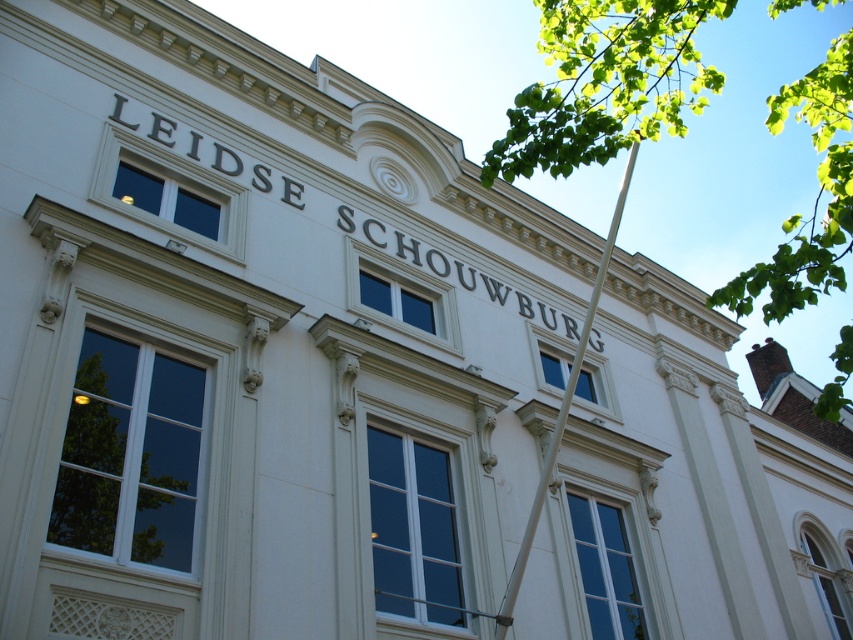
You are standing in front of the Leiden Theatre and notice two points marked on the building facade. The first point is at coordinates point [752,273] and the second is at point [61,529]. Which point is closer to your eyes?

Point [752,273] is further to the viewer than point [61,529], so the point closer to your eyes is point [61,529].

You are a photographer standing in front of the Leiden Theatre. You want to capture a photo that includes both the green leafy tree at upper right and the white metallic pole at upper right. However, you notice that one of them is blocking the other. Which object is blocking the other?

The green leafy tree at upper right is in front of the white metallic pole at upper right, so the tree is blocking the pole.

You are standing in front of the Leiden Theatre and want to take a photo of the building without any obstructions. The green leafy tree at lower left is in the way. Where should you move to avoid it?

Move to the right side of the building since the green leafy tree at lower left is located at the lower left corner, which is at point (131, 456) in 2D coordinates. By moving to the right, you can position yourself away from the tree and capture an unobstructed view of the Leiden Theatre.